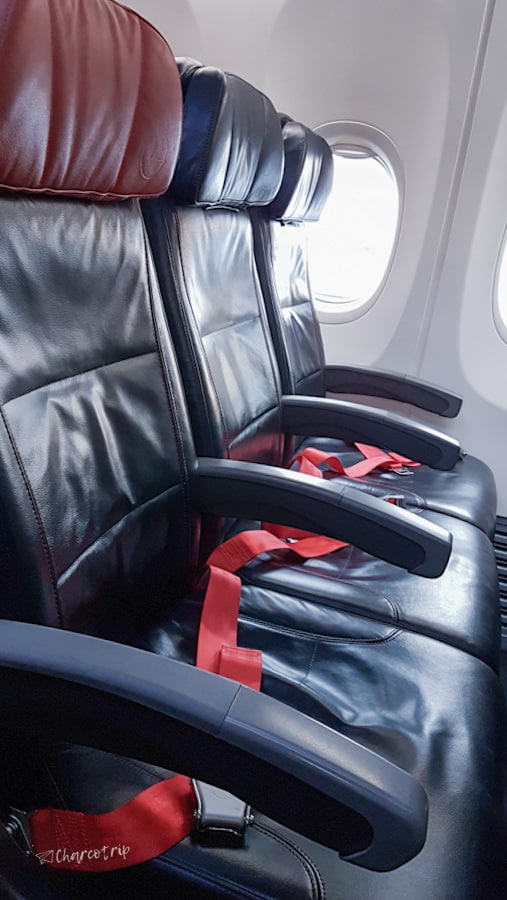
This screenshot has width=507, height=900. Find the location of `airline seat armrest`. airline seat armrest is located at coordinates (226, 736), (333, 507), (365, 415), (386, 375).